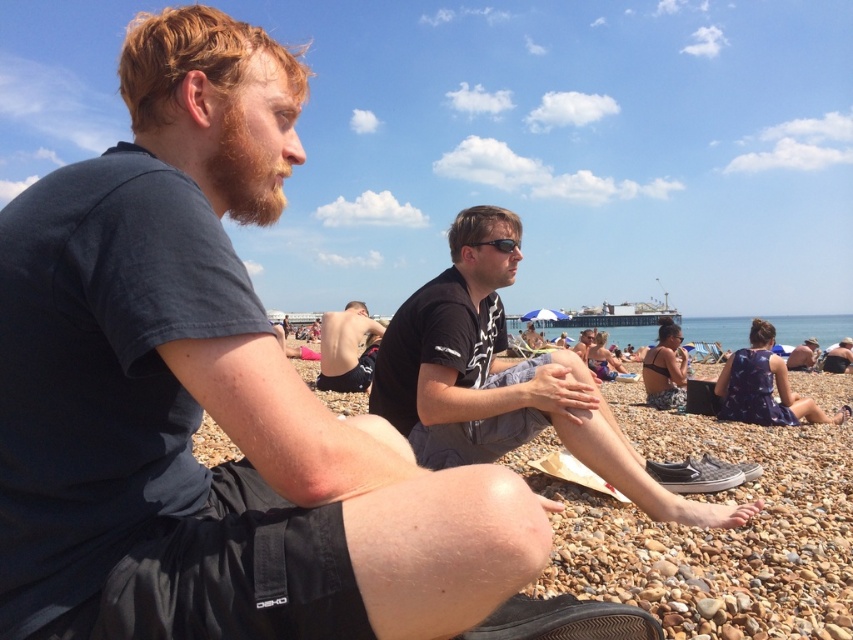
Who is more distant from viewer, (115,497) or (450,310)?

The point (450,310) is behind.

Does dark blue t-shirt at left appear on the left side of black matte shirt at center?

Correct, you'll find dark blue t-shirt at left to the left of black matte shirt at center.

From the picture: Measure the distance between dark blue t-shirt at left and camera.

dark blue t-shirt at left is 1.65 meters away from camera.

At what (x,y) coordinates should I click in order to perform the action: click on dark blue t-shirt at left. Please return your answer as a coordinate pair (x, y). This screenshot has width=853, height=640. Looking at the image, I should click on (204, 403).

Between dark blue t-shirt at left and matte black phone at center, which one has more height?

With more height is dark blue t-shirt at left.

Does dark blue t-shirt at left come behind matte black phone at center?

No, it is not.

Which is in front, point (112, 369) or point (354, 307)?

Point (112, 369)

At what (x,y) coordinates should I click in order to perform the action: click on dark blue t-shirt at left. Please return your answer as a coordinate pair (x, y). The height and width of the screenshot is (640, 853). Looking at the image, I should click on click(204, 403).

Which is in front, point (788, 364) or point (498, 246)?

Point (498, 246) is in front.

Describe the element at coordinates (804, 355) in the screenshot. I see `dark blue t-shirt at center` at that location.

Which is behind, point (790, 353) or point (492, 241)?

Point (790, 353)

The height and width of the screenshot is (640, 853). Identify the location of dark blue t-shirt at center. (804, 355).